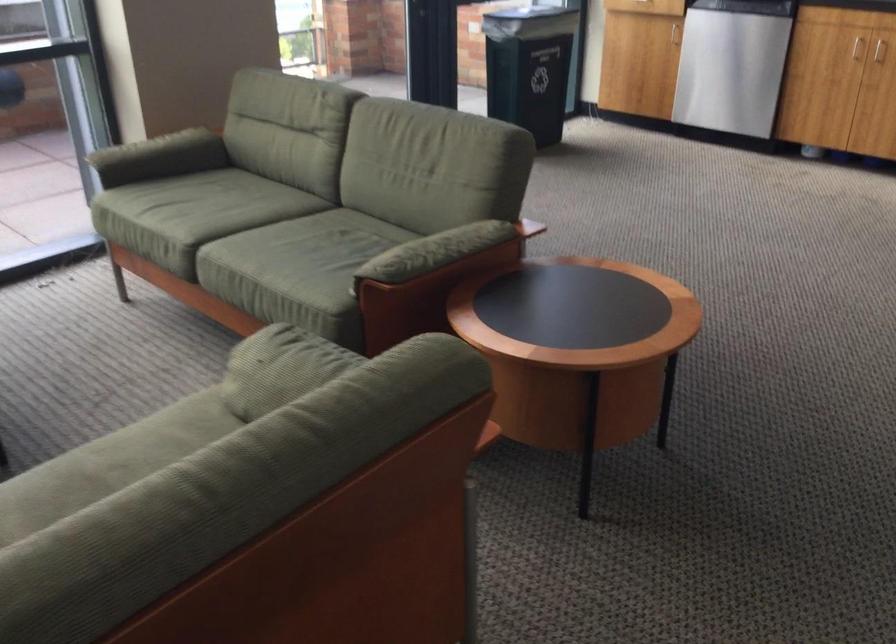
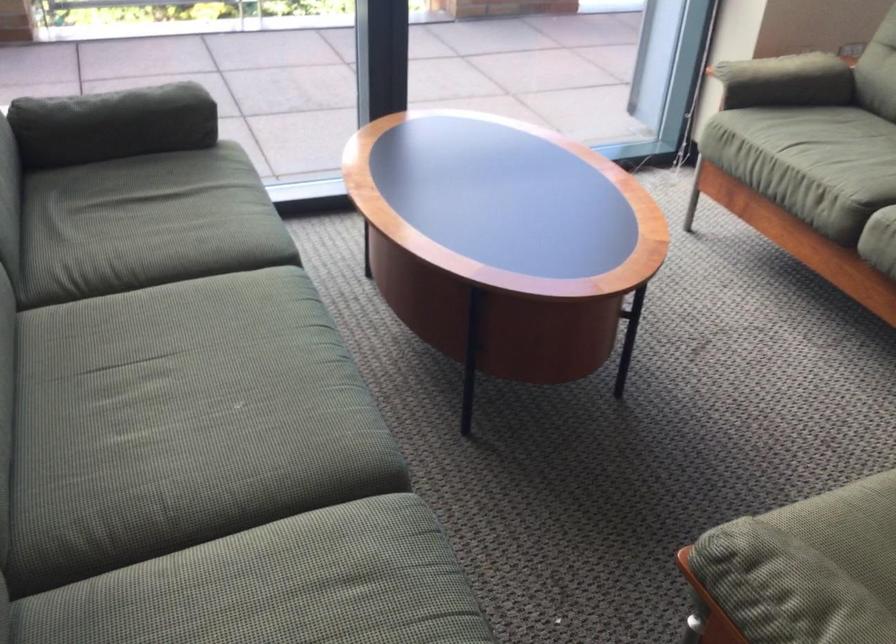
Find the pixel in the second image that matches (x=188, y=228) in the first image.

(846, 180)